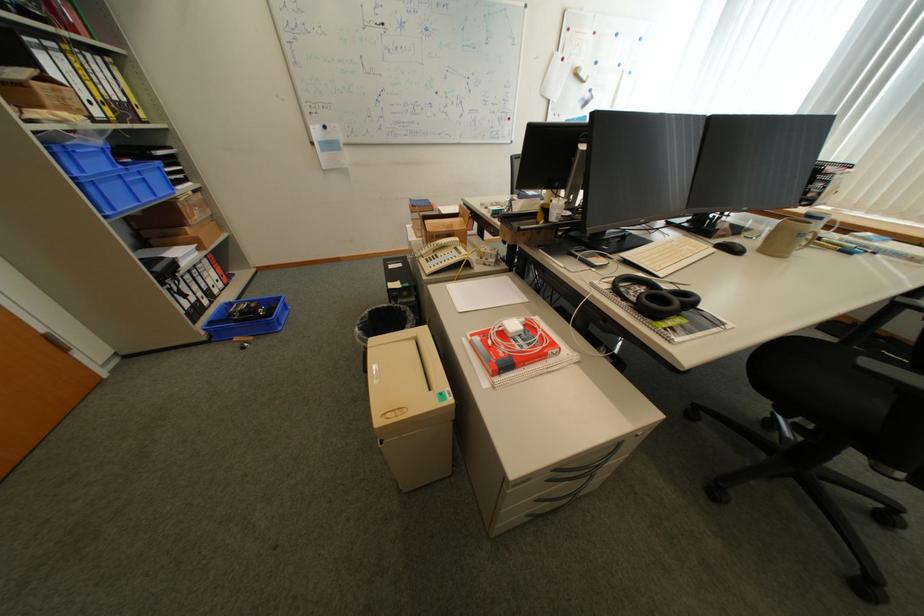
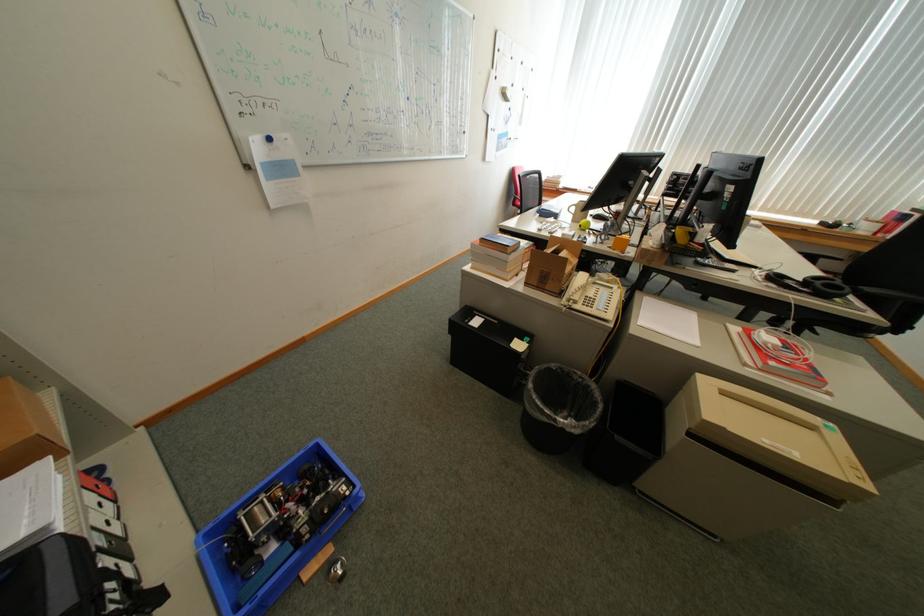
Where in the second image is the point corresponding to the point at 261,302 from the first image?

(276, 490)